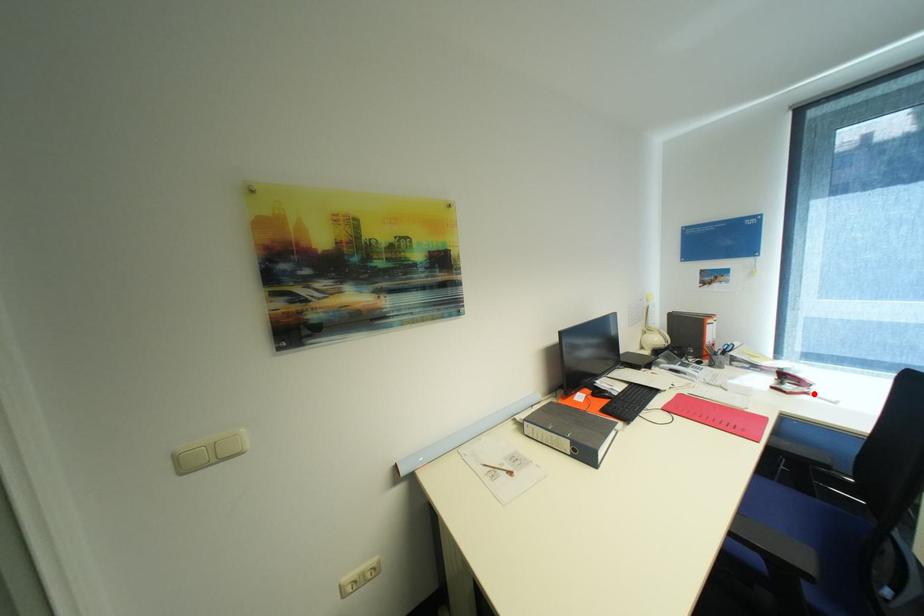
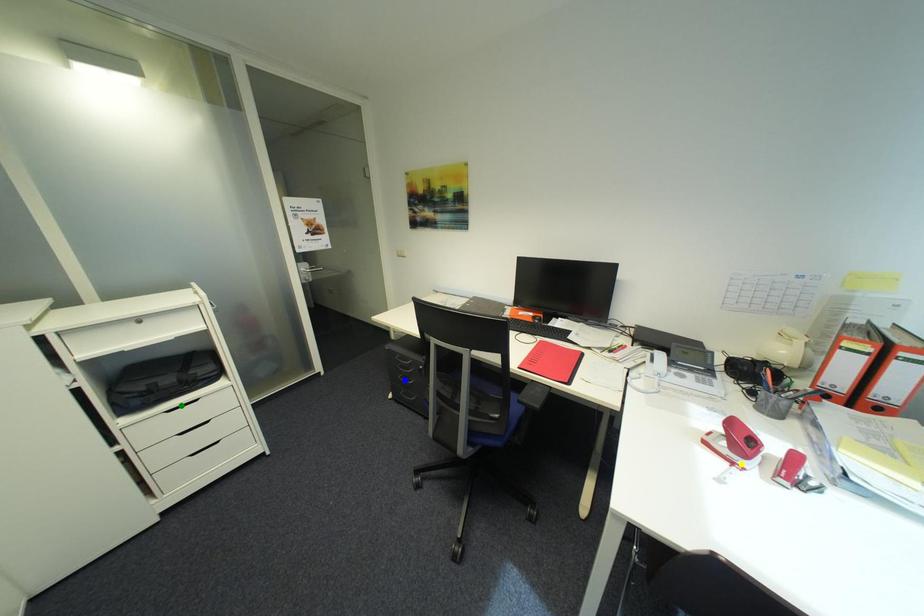
Question: I am providing you with two images of the same scene from different viewpoints. A red point is marked on the first image. You are given multiple points on the second image. In image 2, which mark is for the same physical point as the one in image 1?

Choices:
 (A) yellow point
 (B) blue point
 (C) green point

Answer: (A)